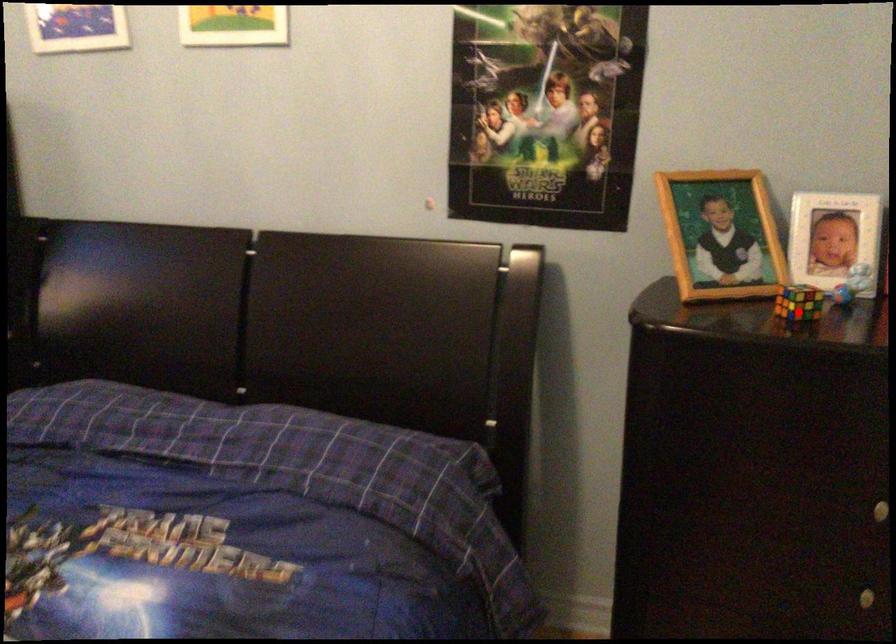
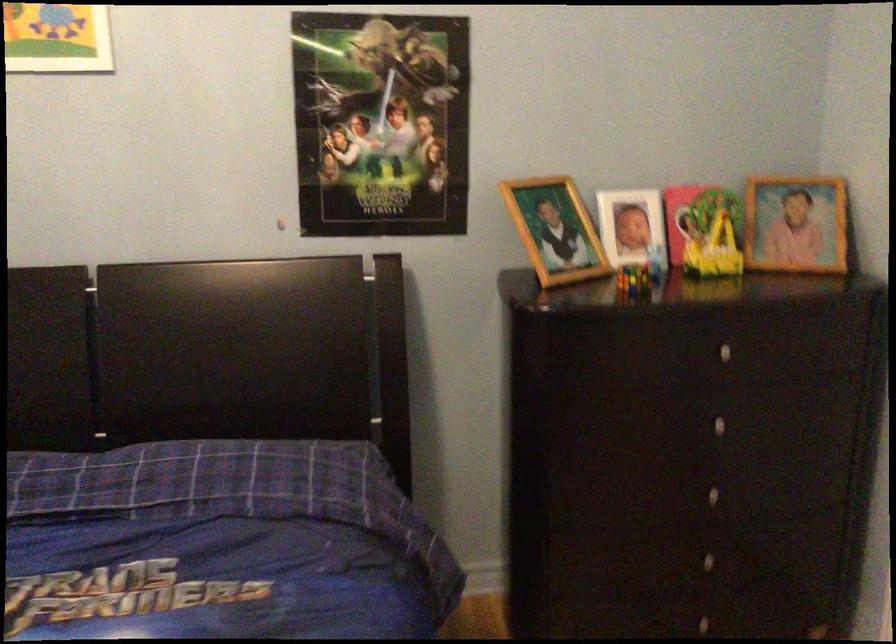
Question: I am providing you with two images of the same scene from different viewpoints. Given a red point in image1, look at the same physical point in image2. Is it:

Choices:
 (A) Closer to the viewpoint
 (B) Farther from the viewpoint

Answer: (B)